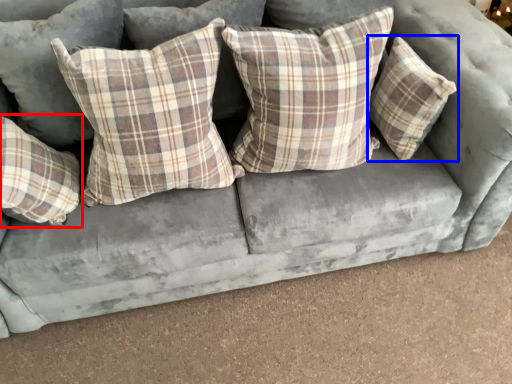
Question: Which point is further to the camera, pillow (highlighted by a red box) or pillow (highlighted by a blue box)?

Choices:
 (A) pillow
 (B) pillow

Answer: (B)